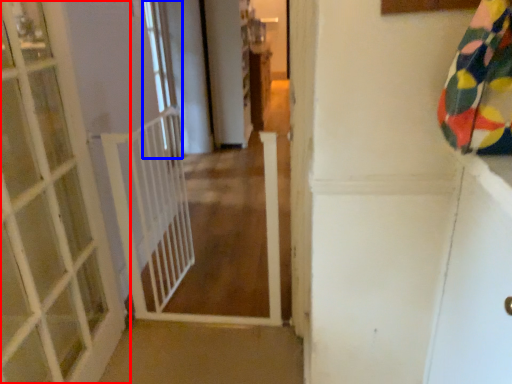
Question: Which point is closer to the camera, door (highlighted by a red box) or window (highlighted by a blue box)?

Choices:
 (A) door
 (B) window

Answer: (A)